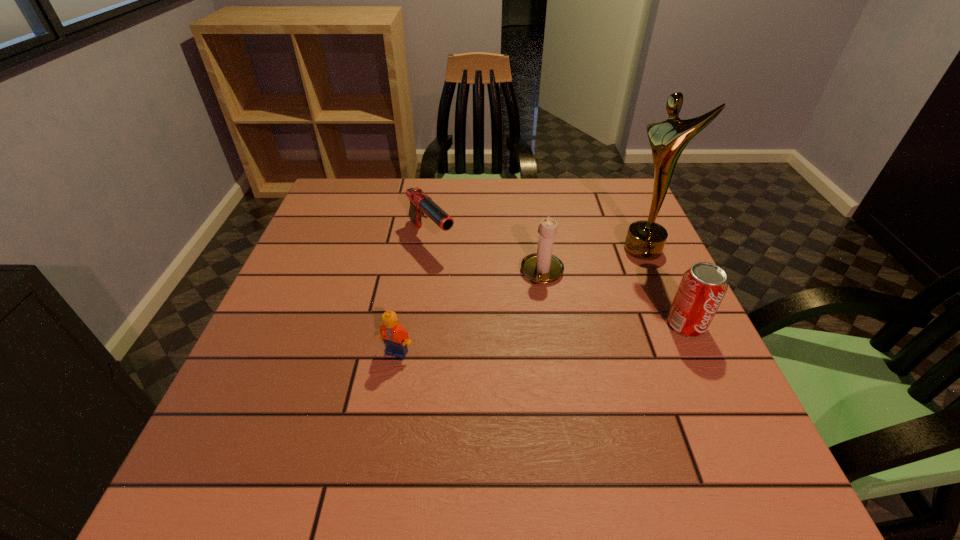
The image size is (960, 540). What are the coordinates of `vacant area situated on the front-facing side of the award` in the screenshot? It's located at (568, 301).

Where is `free space located 0.300m on the front-facing side of the award`? free space located 0.300m on the front-facing side of the award is located at coordinates (546, 315).

Find the location of a particular element. This screenshot has height=540, width=960. free space located on the front-facing side of the award is located at coordinates (564, 303).

Where is `vacant space located 0.160m on the handle side of the candle holder`? vacant space located 0.160m on the handle side of the candle holder is located at coordinates (525, 342).

Find the location of `free space located on the handle side of the candle holder`. free space located on the handle side of the candle holder is located at coordinates (505, 419).

This screenshot has height=540, width=960. What are the coordinates of `vacant space located on the handle side of the candle holder` in the screenshot? It's located at (506, 414).

Where is `object located at the far edge`? object located at the far edge is located at coordinates (420, 203).

I want to click on soda can that is at the right edge, so click(x=702, y=288).

Find the location of a particular element. The width and height of the screenshot is (960, 540). award situated at the right edge is located at coordinates (645, 240).

Image resolution: width=960 pixels, height=540 pixels. I want to click on free space at the far edge of the desktop, so click(x=492, y=213).